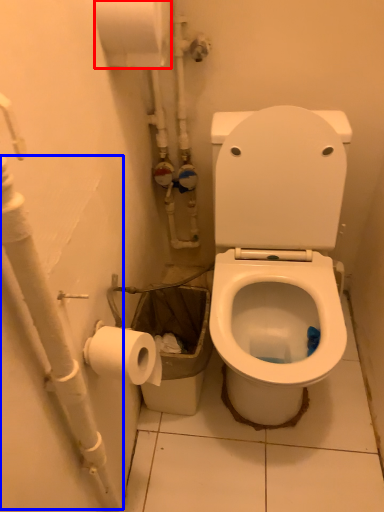
Question: Among these objects, which one is farthest to the camera, toilet paper (highlighted by a red box) or water pipe (highlighted by a blue box)?

Choices:
 (A) toilet paper
 (B) water pipe

Answer: (A)